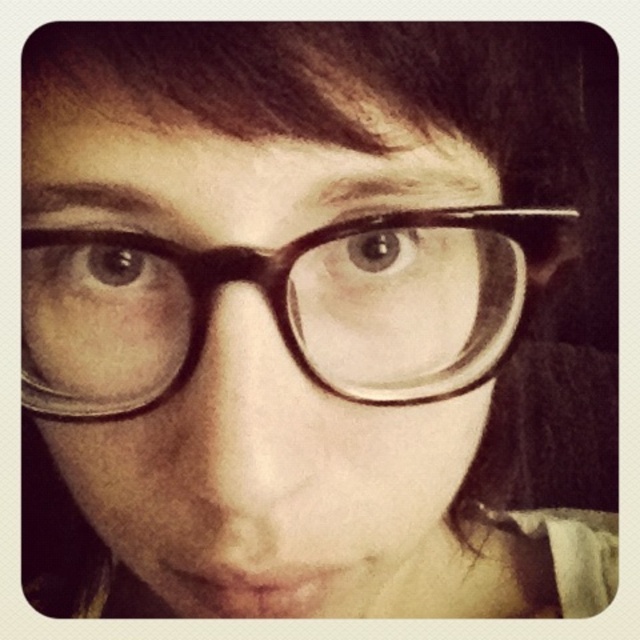
Question: Which of the following is the closest to the observer?

Choices:
 (A) black plastic glasses at center
 (B) matte black glasses at center

Answer: (B)

Question: Does matte black glasses at center appear on the right side of black plastic glasses at center?

Choices:
 (A) no
 (B) yes

Answer: (A)

Question: Does matte black glasses at center have a larger size compared to black plastic glasses at center?

Choices:
 (A) no
 (B) yes

Answer: (B)

Question: Among these points, which one is farthest from the camera?

Choices:
 (A) (72, 202)
 (B) (480, 260)

Answer: (B)

Question: Which of the following is the closest to the observer?

Choices:
 (A) (500, 312)
 (B) (292, 616)

Answer: (A)

Question: Can you confirm if matte black glasses at center is positioned to the right of black plastic glasses at center?

Choices:
 (A) yes
 (B) no

Answer: (B)